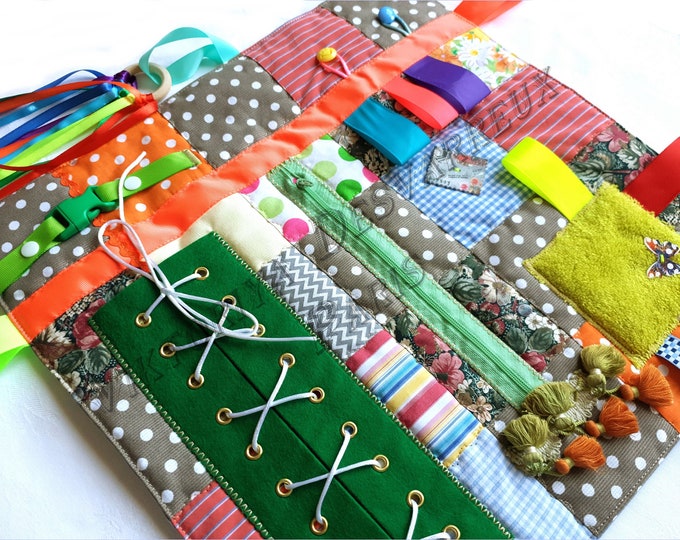
Image resolution: width=680 pixels, height=540 pixels. Find the location of `white table`. white table is located at coordinates (605, 59).